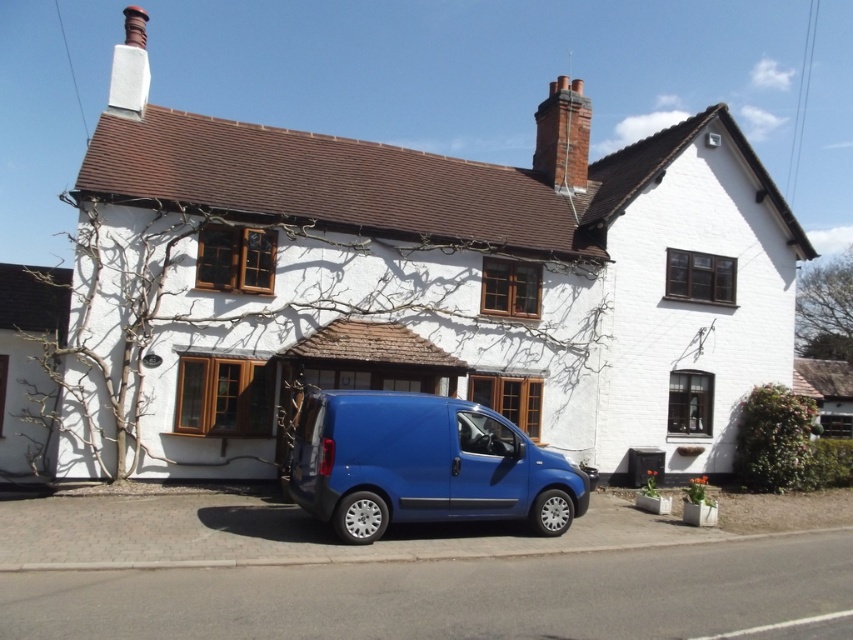
You are standing on the sidewalk in front of the house and want to walk to the blue van parked on the street. Which point, point (21, 314) or point (808, 381), is closer to you as you start walking towards the van?

Point (21, 314) is closer to the viewer than point (808, 381), so it is closer to you as you start walking towards the van.

You are a delivery driver who needs to park your blue matte van at center as close as possible to the red brick chimney at upper right without blocking the driveway. The minimum distance required between the van and any structure is 3 meters. Is it possible to park the van closer than 12.26 meters to the chimney while still maintaining the required safety distance?

The blue matte van at center and red brick chimney at upper right are 12.26 meters apart. Since the minimum required distance is 3 meters, you can park the van closer than 12.26 meters as long as it stays at least 3 meters away from the chimney and other structures.

You are a drone operator trying to capture a photo of the white painted wood at left and the red brick chimney at upper right from the air. What is the minimum distance you need to maintain between your drone and each object to ensure both are in frame?

The white painted wood at left is 43.41 meters away from the red brick chimney at upper right. To capture both in frame, the drone must be positioned at least 43.41 meters away from the closer object. However, since the exact positions aren